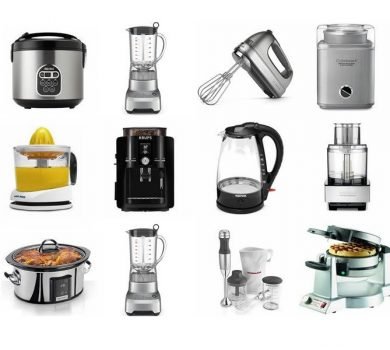
This screenshot has height=350, width=390. In order to click on silver hand mixer in this screenshot , I will do `click(245, 60)`.